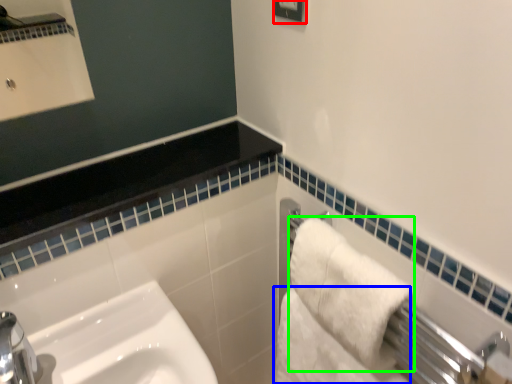
Question: Which is nearer to the square (highlighted by a red box)? bath towel (highlighted by a blue box) or bath towel (highlighted by a green box).

Choices:
 (A) bath towel
 (B) bath towel

Answer: (B)